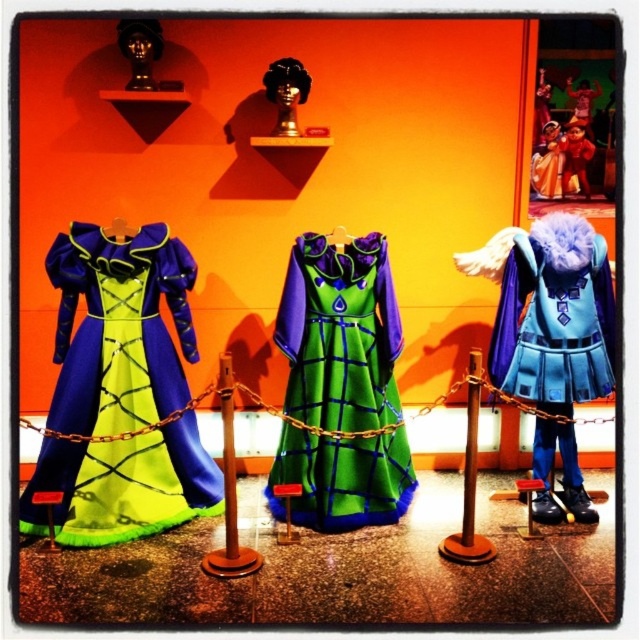
Question: Is matte purple and green gown at center to the left of brushed metal pole at center from the viewer's perspective?

Choices:
 (A) no
 (B) yes

Answer: (B)

Question: Which point is closer to the camera?

Choices:
 (A) velvet red cape at center
 (B) brown wooden pole at center

Answer: (B)

Question: Is blue felt cape at right thinner than blue velvet cape at center?

Choices:
 (A) no
 (B) yes

Answer: (A)

Question: Estimate the real-world distances between objects in this image. Which object is farther from the blue felt cape at right?

Choices:
 (A) green velvet dress at center
 (B) brown wooden pole at center
 (C) blue velvet cape at center
 (D) brushed metal pole at center

Answer: (D)

Question: Can you confirm if green velvet dress at center is positioned to the left of blue velvet cape at center?

Choices:
 (A) yes
 (B) no

Answer: (A)

Question: Among these objects, which one is farthest from the camera?

Choices:
 (A) blue velvet cape at center
 (B) green velvet dress at center
 (C) velvet red cape at center

Answer: (C)